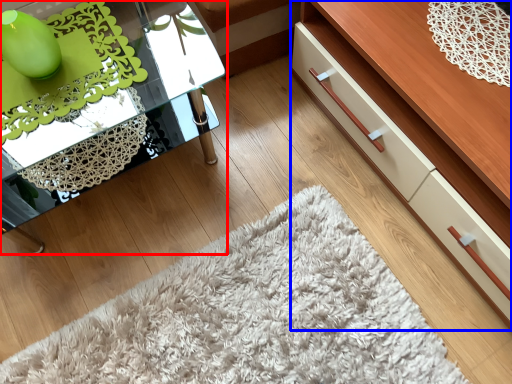
Question: Which point is further to the camera, table (highlighted by a red box) or dresser (highlighted by a blue box)?

Choices:
 (A) table
 (B) dresser

Answer: (A)